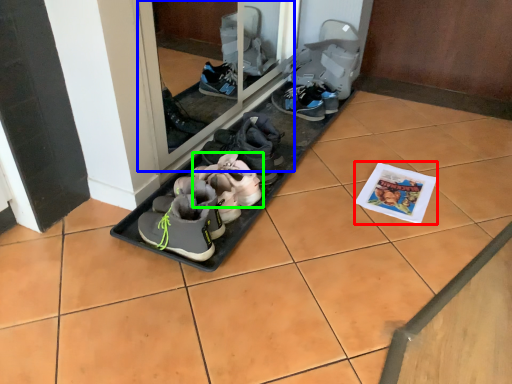
Question: Which object is positioned closest to magazine (highlighted by a red box)? Select from glass door (highlighted by a blue box) and footwear (highlighted by a green box).

Choices:
 (A) glass door
 (B) footwear

Answer: (B)